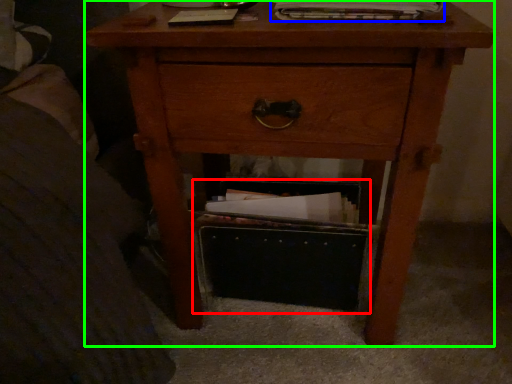
Question: Which object is the closest to the shoe box (highlighted by a red box)? Choose among these: magazine (highlighted by a blue box) or nightstand (highlighted by a green box).

Choices:
 (A) magazine
 (B) nightstand

Answer: (B)